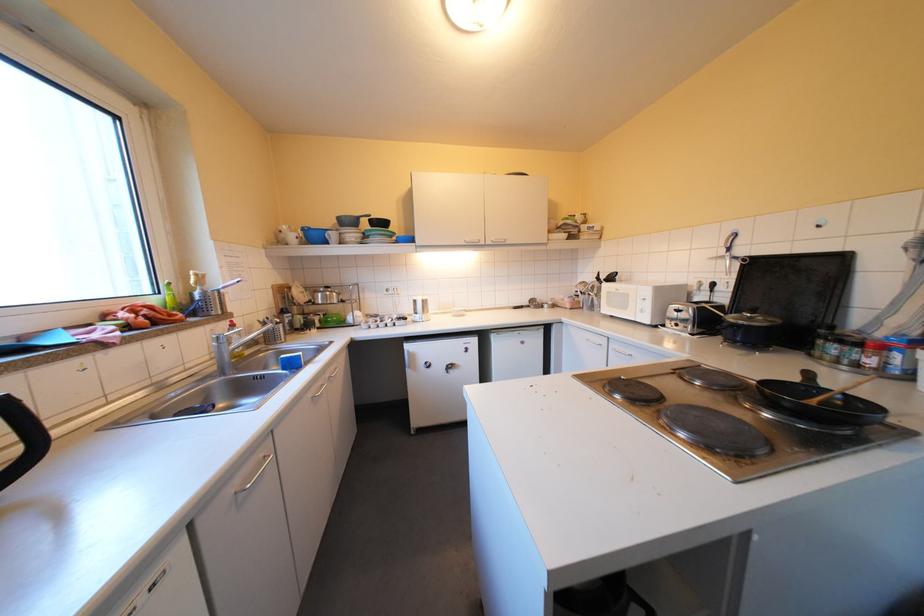
Where would you lift the blue bowl? Please return your answer as a coordinate pair (x, y).

(313, 235)